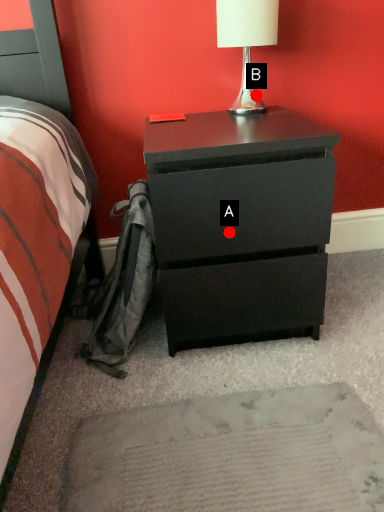
Question: Two points are circled on the image, labeled by A and B beside each circle. Which point is farther to the camera?

Choices:
 (A) A is further
 (B) B is further

Answer: (B)